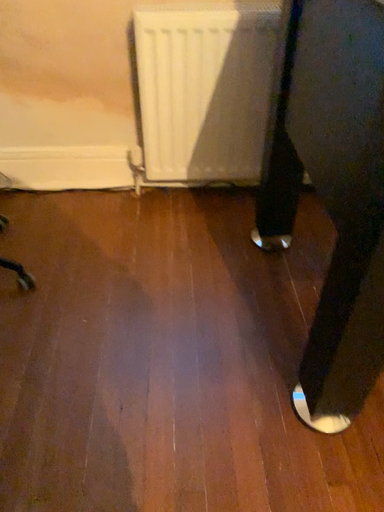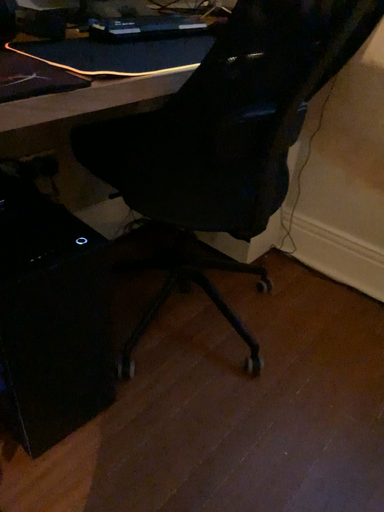
Question: How did the camera likely rotate when shooting the video?

Choices:
 (A) rotated downward
 (B) rotated upward

Answer: (B)